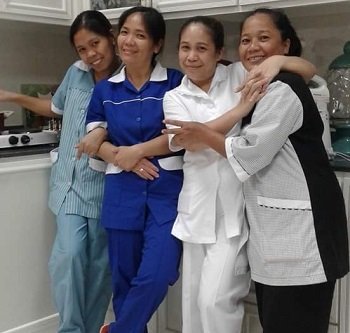
The width and height of the screenshot is (350, 333). What are the coordinates of `drawer` in the screenshot? It's located at (39, 216).